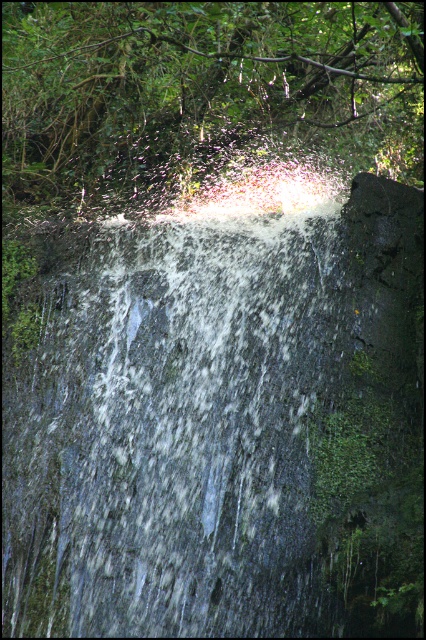
You are standing at the edge of a forest path and see a point marked at coordinates (218, 422). What does this point indicate in the scene?

The point at coordinates (218, 422) marks the translucent glass waterfall at center.

You are standing at the edge of the forest near the translucent glass waterfall at center. If you walk directly towards the waterfall, will you first encounter the rocky ledge or the misty spray?

The translucent glass waterfall at center is located at point (218, 422), so you will first encounter the misty spray before reaching the rocky ledge.

You are standing at the point labeled point [293,232]. You want to throw a pebble to hit a target located 10 meters away. Will your pebble reach the target?

The distance between the point labeled point [293,232] and the target is 9.92 meters, so yes, the pebble will reach the target since the distance is slightly less than 10 meters.